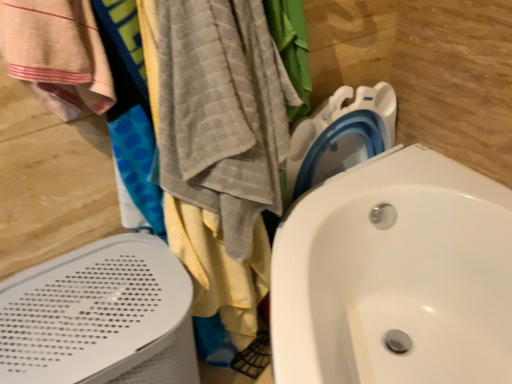
At what (x,y) coordinates should I click in order to perform the action: click on vacant point above white perforated bath heater at left (from a real-world perspective). Please return your answer as a coordinate pair (x, y). This screenshot has width=512, height=384. Looking at the image, I should click on click(x=74, y=306).